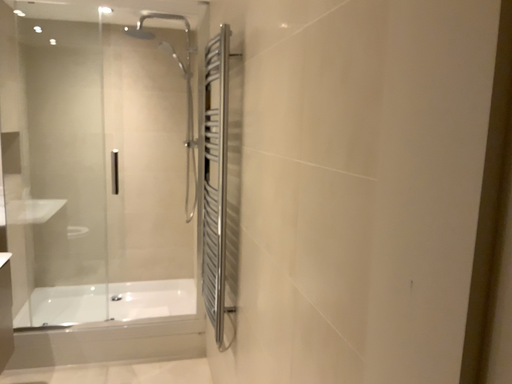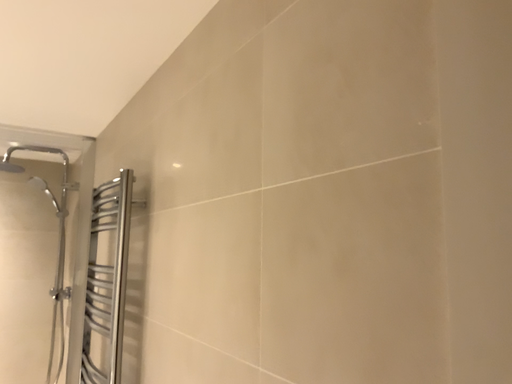
Question: How did the camera likely rotate when shooting the video?

Choices:
 (A) rotated upward
 (B) rotated downward

Answer: (A)